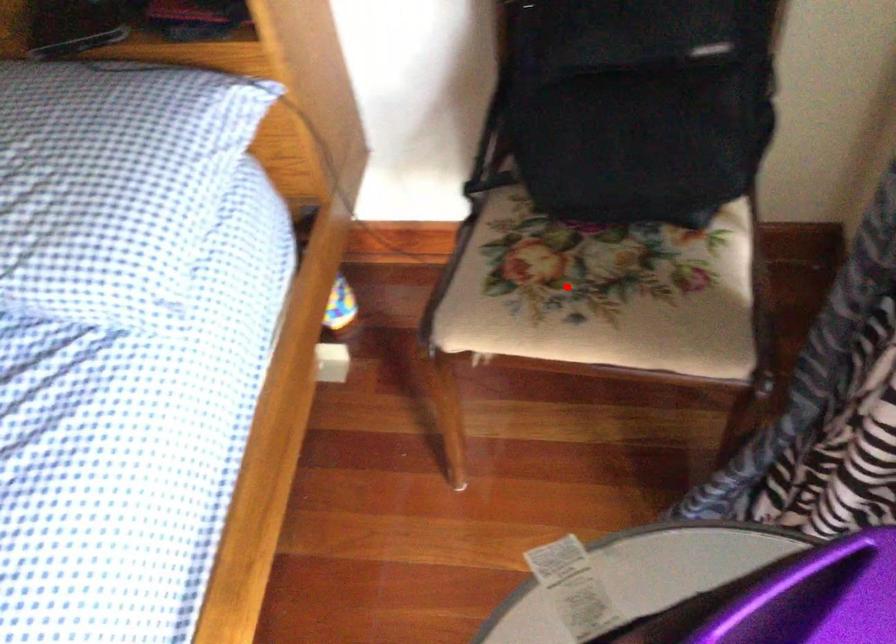
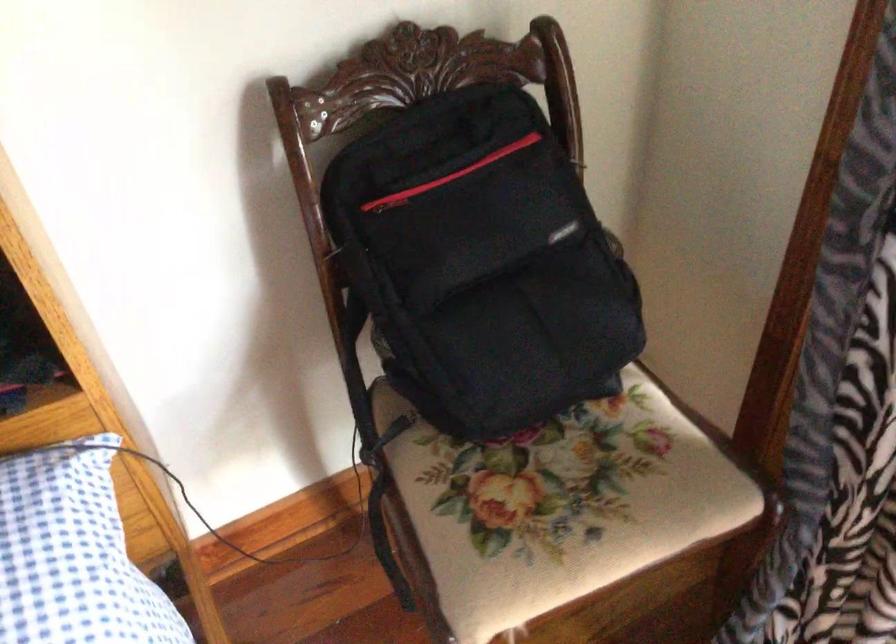
Locate, in the second image, the point that corresponds to the highlighted location in the first image.

(556, 506)